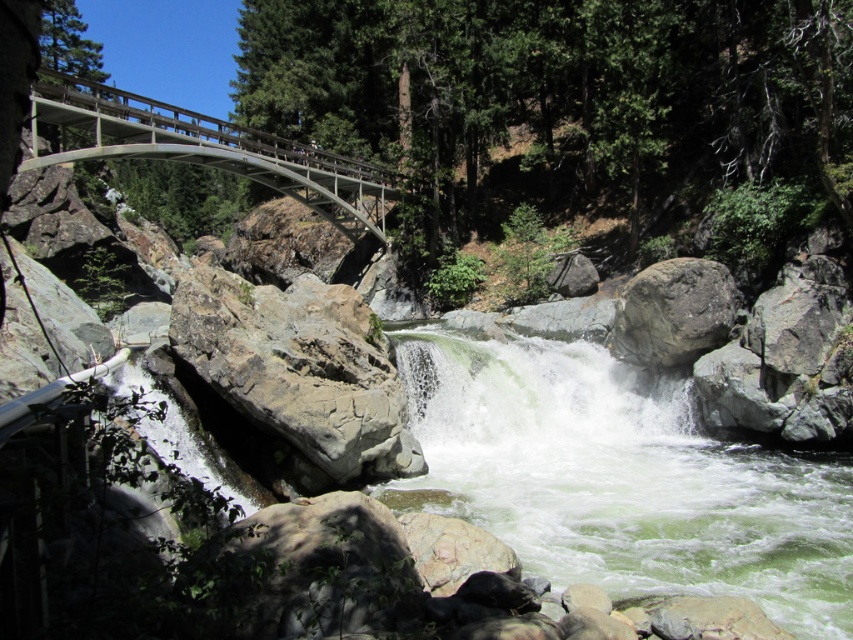
Question: Can you confirm if rocky gray boulder at center-left is positioned above gray rough rock at center-right?

Choices:
 (A) yes
 (B) no

Answer: (B)

Question: Which object is positioned farthest from the rocky gray boulder at center-left?

Choices:
 (A) metallic gray bridge at upper left
 (B) gray rough rock at center-right

Answer: (A)

Question: Among these points, which one is nearest to the camera?

Choices:
 (A) (657, 355)
 (B) (201, 340)
 (C) (73, 84)

Answer: (B)

Question: Can you confirm if metallic gray bridge at upper left is positioned above gray rough rock at center-right?

Choices:
 (A) no
 (B) yes

Answer: (B)

Question: Estimate the real-world distances between objects in this image. Which object is farther from the gray rough rock at center-right?

Choices:
 (A) metallic gray bridge at upper left
 (B) rocky gray boulder at center-left

Answer: (A)

Question: Is metallic gray bridge at upper left smaller than gray rough rock at center-right?

Choices:
 (A) no
 (B) yes

Answer: (A)